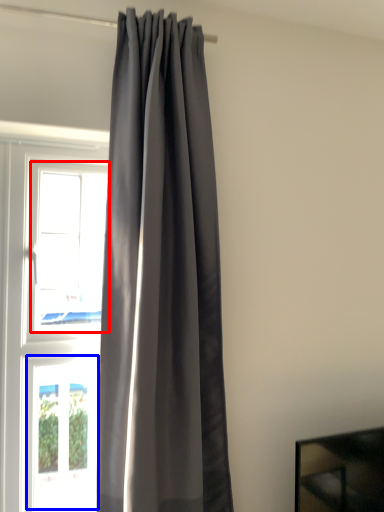
Question: Which object appears closest to the camera in this image, window (highlighted by a red box) or window (highlighted by a blue box)?

Choices:
 (A) window
 (B) window

Answer: (A)